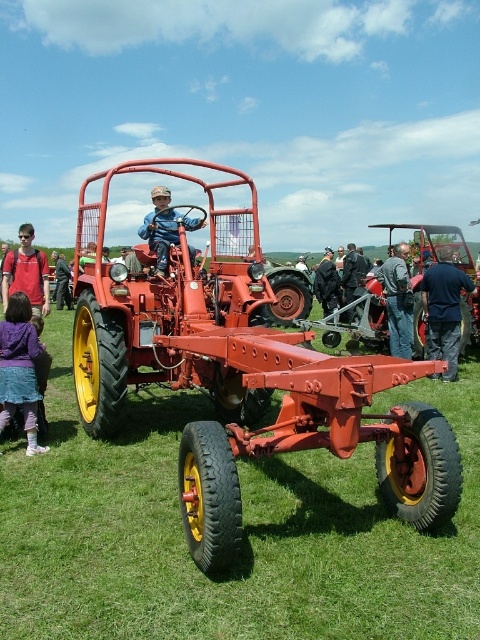
What do you see at coordinates (164, 227) in the screenshot? The image size is (480, 640). I see `blue denim overalls at center` at bounding box center [164, 227].

Which is in front, point (157, 211) or point (362, 259)?

Point (157, 211) is in front.

Where is `blue denim overalls at center`? blue denim overalls at center is located at coordinates (164, 227).

Describe the element at coordinates (397, 301) in the screenshot. The width and height of the screenshot is (480, 640). I see `denim jacket at center` at that location.

Is denim jacket at center shorter than dark blue jacket at center?

No.

At what (x,y) coordinates should I click in order to perform the action: click on denim jacket at center. Please return your answer as a coordinate pair (x, y). The height and width of the screenshot is (640, 480). Looking at the image, I should click on (397, 301).

Does purple fabric dress at lower left have a lesser width compared to dark blue jacket at center?

No.

Which is behind, point (36, 406) or point (352, 285)?

The point (352, 285) is behind.

Which is in front, point (12, 314) or point (347, 244)?

Positioned in front is point (12, 314).

The image size is (480, 640). Identify the location of purple fabric dress at lower left. (20, 369).